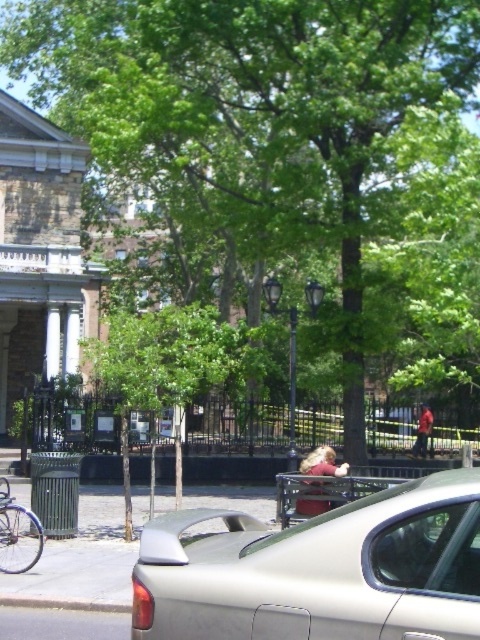
Question: In this image, where is silver metallic bicycle at lower left located relative to gray concrete curb at lower left?

Choices:
 (A) above
 (B) below

Answer: (A)

Question: From the image, what is the correct spatial relationship of silver metallic car at center in relation to silver metallic bicycle at lower left?

Choices:
 (A) above
 (B) below

Answer: (A)

Question: Which point appears farthest from the camera in this image?

Choices:
 (A) [x=12, y=556]
 (B) [x=338, y=520]
 (C) [x=115, y=605]

Answer: (A)

Question: Which object appears farthest from the camera in this image?

Choices:
 (A) silver metallic car at center
 (B) silver metallic bicycle at lower left
 (C) gray concrete curb at lower left

Answer: (B)

Question: Observing the image, what is the correct spatial positioning of silver metallic car at center in reference to gray concrete curb at lower left?

Choices:
 (A) right
 (B) left

Answer: (A)

Question: Which point is closer to the camera?

Choices:
 (A) (123, 612)
 (B) (240, 570)
 (C) (17, 525)

Answer: (B)